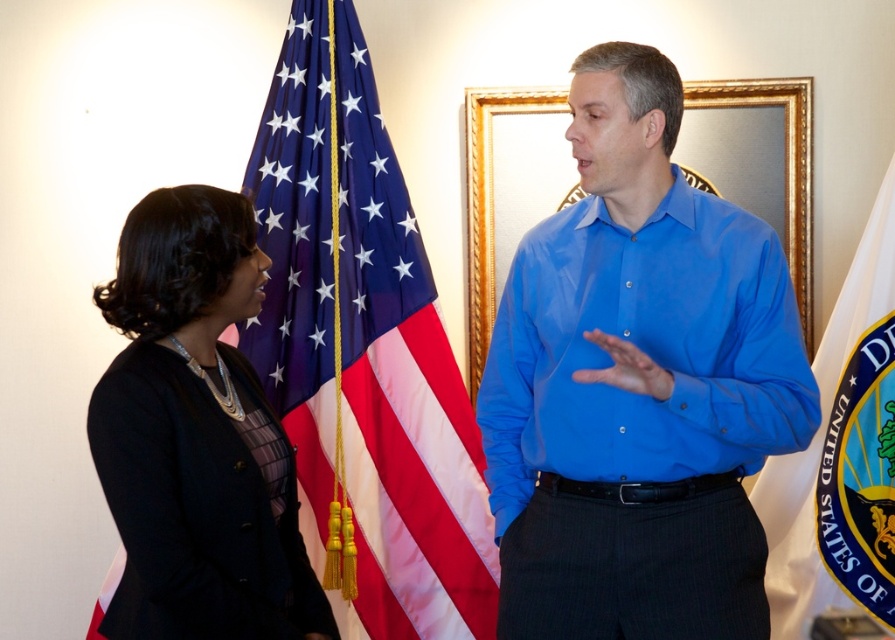
You are attending a formal event and notice two flags displayed in the background. The blue fabric flag at center and the white fabric flag at right. Which flag is taller?

The blue fabric flag at center is taller than the white fabric flag at right.

You are an event planner organizing a presentation. You need to decide if the blue smooth shirt at center can be fully visible next to the blue fabric flag at center without overlapping. Based on their widths, can you confirm if this arrangement is possible?

The blue smooth shirt at center has a lesser width compared to the blue fabric flag at center, so yes, it can be placed next to the flag without overlapping as the shirt is narrower.